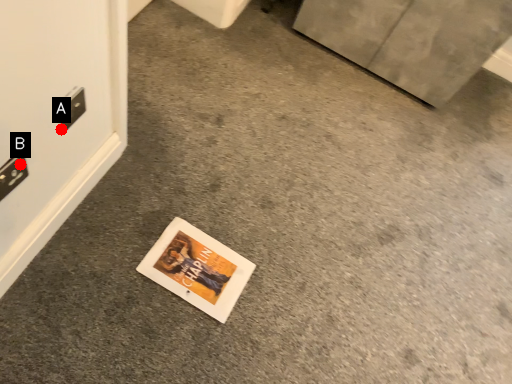
Question: Two points are circled on the image, labeled by A and B beside each circle. Which point appears closest to the camera in this image?

Choices:
 (A) A is closer
 (B) B is closer

Answer: (B)